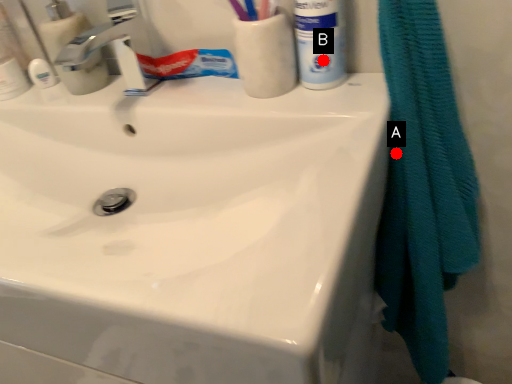
Question: Two points are circled on the image, labeled by A and B beside each circle. Which of the following is the closest to the observer?

Choices:
 (A) A is closer
 (B) B is closer

Answer: (A)